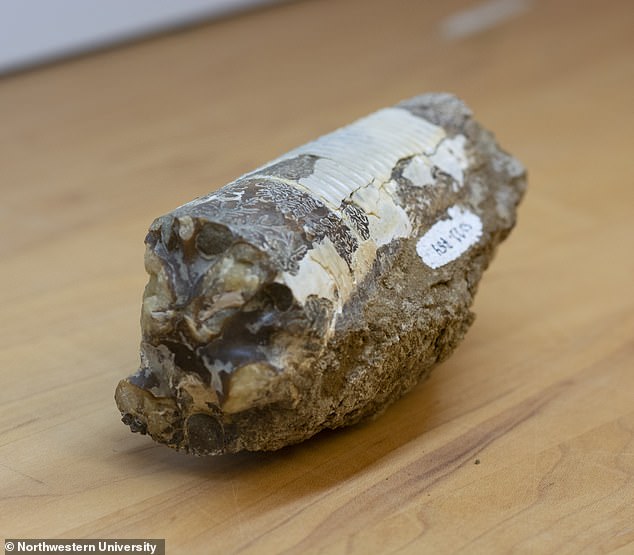
Where is `dark diagonal wood grain, bottom right side`? This screenshot has height=555, width=634. dark diagonal wood grain, bottom right side is located at coordinates (436, 473), (468, 455), (512, 428), (406, 500).